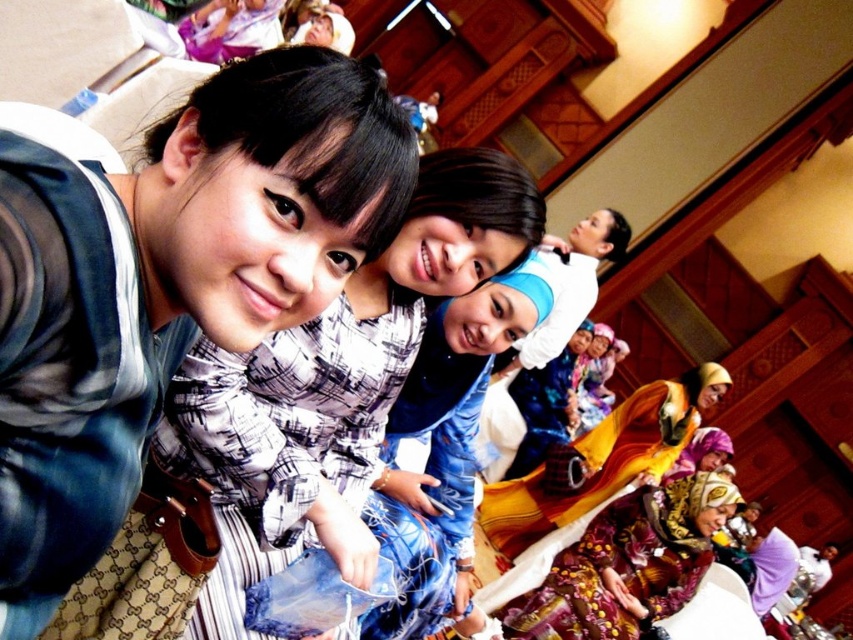
You are a photographer at the event and want to capture a photo of both the matte blue dress at center and the printed silk dress at lower right. Which dress should you focus on first if you want to include both in the frame without moving the camera?

The matte blue dress at center is located above the printed silk dress at lower right, so you should focus on the matte blue dress at center first to ensure both are in the frame without moving the camera.

You are a photographer at the event and want to ensure both the matte blue dress at center and the yellow satin dress at lower right are visible in your photo. Given that the camera frame can only accommodate items up to the width of the wider dress, will you need to adjust the frame to include both dresses?

The yellow satin dress at lower right is wider than the matte blue dress at center. Since the camera frame can only accommodate up to the width of the wider dress, you will need to adjust the frame to ensure both dresses are fully visible.

In the scene of the lively social gathering, there are two dresses visible. The first is a matte blue dress at center, and the second is a printed silk dress at lower right. From the perspective of someone standing in front of the group, which dress is positioned to the left?

The matte blue dress at center is positioned to the left of the printed silk dress at lower right.